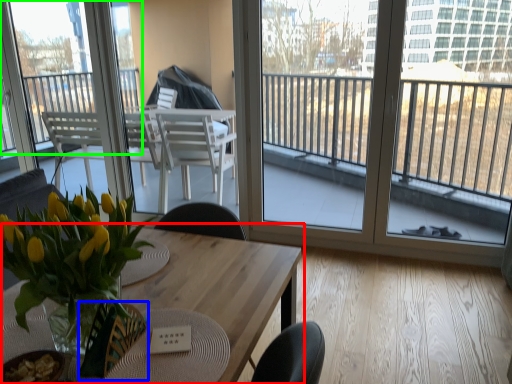
Question: Which object is positioned farthest from table (highlighted by a red box)? Select from armchair (highlighted by a blue box) and window (highlighted by a green box).

Choices:
 (A) armchair
 (B) window

Answer: (B)